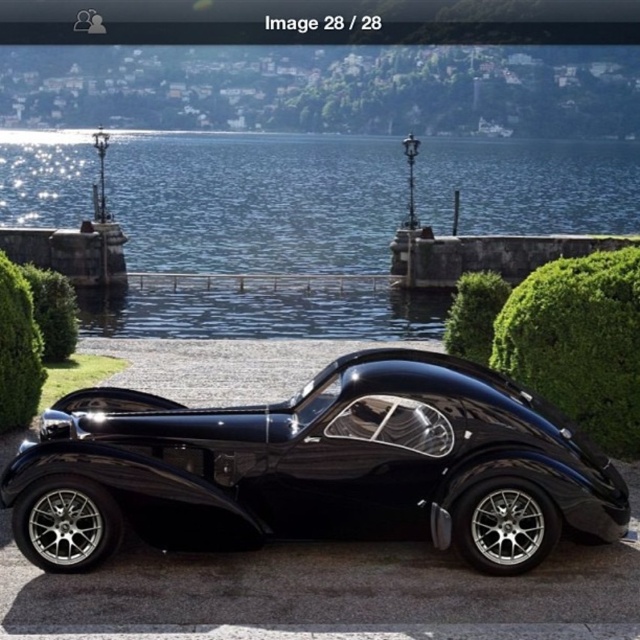
Question: In this image, where is shiny black sports car at center located relative to clear blue water at center?

Choices:
 (A) above
 (B) below

Answer: (B)

Question: From the image, what is the correct spatial relationship of shiny black sports car at center in relation to clear blue water at center?

Choices:
 (A) below
 (B) above

Answer: (A)

Question: Which point is closer to the camera?

Choices:
 (A) (536, 227)
 (B) (157, 476)

Answer: (B)

Question: Is shiny black sports car at center smaller than clear blue water at center?

Choices:
 (A) no
 (B) yes

Answer: (B)

Question: Which point is farther to the camera?

Choices:
 (A) (225, 470)
 (B) (355, 160)

Answer: (B)